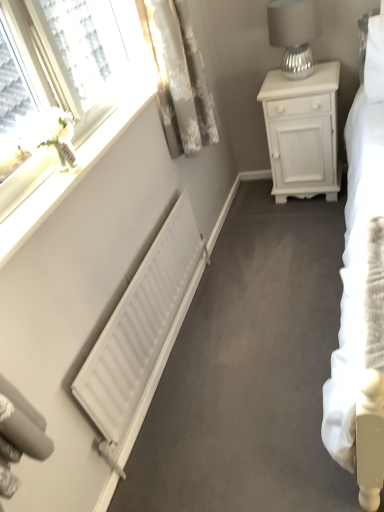
You are a GUI agent. You are given a task and a screenshot of the screen. Output one action in this format:
    pyautogui.click(x=<x>, y=<y>)
    Task: Click on the vacant space that is to the left of white matte nightstand at upper right
    The image size is (384, 512).
    Given the screenshot: What is the action you would take?
    click(254, 210)